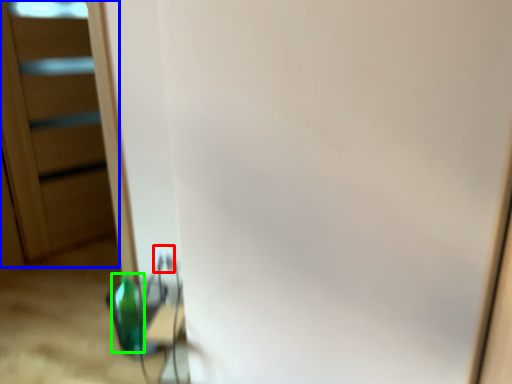
Question: Based on their relative distances, which object is nearer to electric outlet (highlighted by a red box)? Choose from screen door (highlighted by a blue box) and bottle (highlighted by a green box).

Choices:
 (A) screen door
 (B) bottle

Answer: (B)